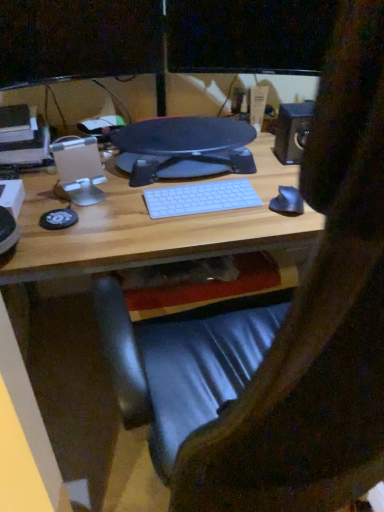
Locate an element on the screen. This screenshot has height=512, width=384. vacant area that lies to the right of white matte keyboard at center is located at coordinates (268, 212).